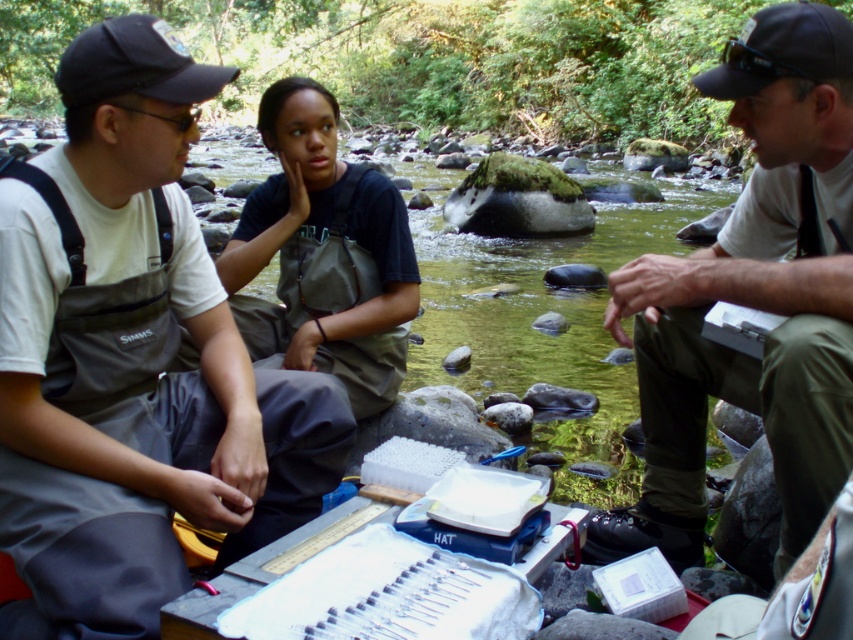
Question: Which of the following is the farthest from the observer?

Choices:
 (A) dark gray waders at center
 (B) black fabric baseball cap at upper left

Answer: (A)

Question: Observing the image, what is the correct spatial positioning of gray fabric waders at left in reference to dark gray waders at center?

Choices:
 (A) right
 (B) left

Answer: (B)

Question: Which object appears farthest from the camera in this image?

Choices:
 (A) matte white shirt at center
 (B) black fabric baseball cap at upper left
 (C) dark gray waders at center
 (D) gray fabric waders at left

Answer: (C)

Question: Is gray fabric waders at left bigger than matte white shirt at center?

Choices:
 (A) yes
 (B) no

Answer: (B)

Question: Does matte white shirt at center have a greater width compared to black fabric baseball cap at upper left?

Choices:
 (A) no
 (B) yes

Answer: (A)

Question: Which object appears closest to the camera in this image?

Choices:
 (A) dark gray waders at center
 (B) black fabric baseball cap at upper left

Answer: (B)